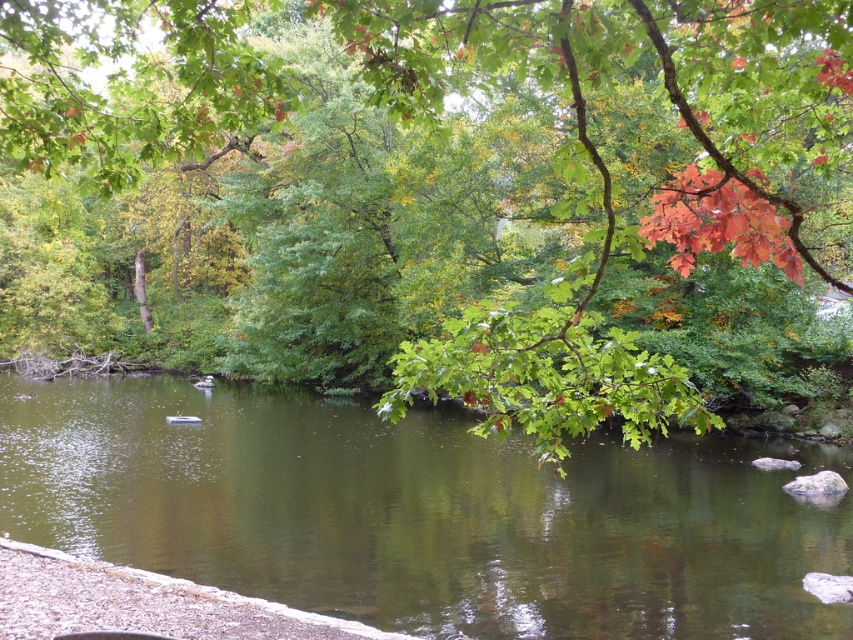
Question: Is green leafy branch at upper center closer to camera compared to green glossy water at center?

Choices:
 (A) no
 (B) yes

Answer: (B)

Question: Is green leafy branch at upper center thinner than green glossy water at center?

Choices:
 (A) yes
 (B) no

Answer: (B)

Question: From the image, what is the correct spatial relationship of green leafy branch at upper center in relation to green glossy water at center?

Choices:
 (A) below
 (B) above

Answer: (B)

Question: Which point is farther to the camera?

Choices:
 (A) green glossy water at center
 (B) green leafy branch at upper center

Answer: (A)